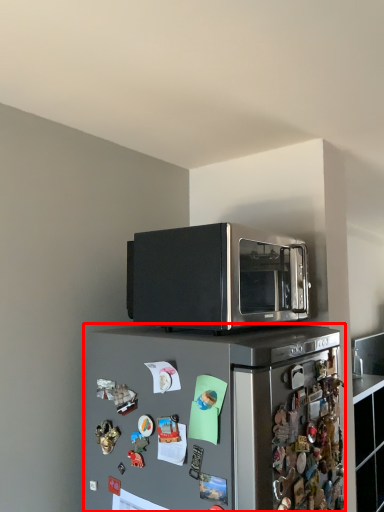
Question: From the image's perspective, where is refrigerator (annotated by the red box) located relative to microwave oven?

Choices:
 (A) above
 (B) below

Answer: (B)